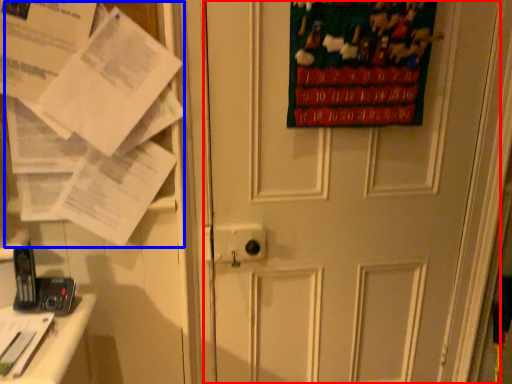
Question: Among these objects, which one is nearest to the camera, door (highlighted by a red box) or paper (highlighted by a blue box)?

Choices:
 (A) door
 (B) paper

Answer: (B)